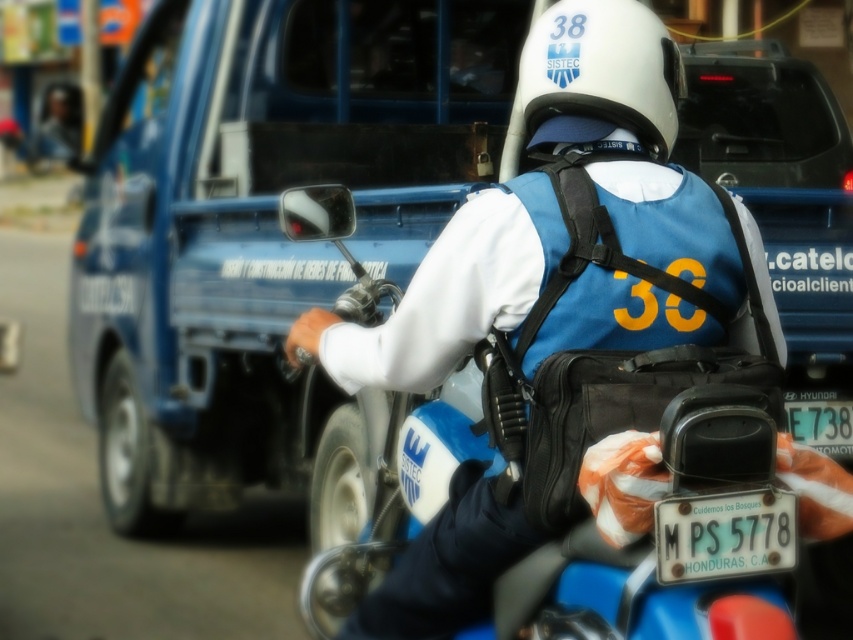
Question: Which of the following is the farthest from the observer?

Choices:
 (A) (636, 106)
 (B) (825, 433)
 (C) (676, 534)
 (D) (750, 420)

Answer: (B)

Question: Which point is farther from the camera taking this photo?

Choices:
 (A) (x=834, y=401)
 (B) (x=734, y=349)
 (C) (x=758, y=541)

Answer: (A)

Question: Is blue matte motorcycle at center positioned at the back of white plastic license plate at center?

Choices:
 (A) no
 (B) yes

Answer: (A)

Question: Does white matte helmet at upper center have a larger size compared to white plastic license plate at center?

Choices:
 (A) yes
 (B) no

Answer: (A)

Question: Is white matte helmet at upper center to the right of white plastic license plate at lower right from the viewer's perspective?

Choices:
 (A) yes
 (B) no

Answer: (B)

Question: Which point appears farthest from the camera in this image?

Choices:
 (A) (703, 506)
 (B) (825, 428)
 (C) (531, 45)
 (D) (590, 417)

Answer: (B)